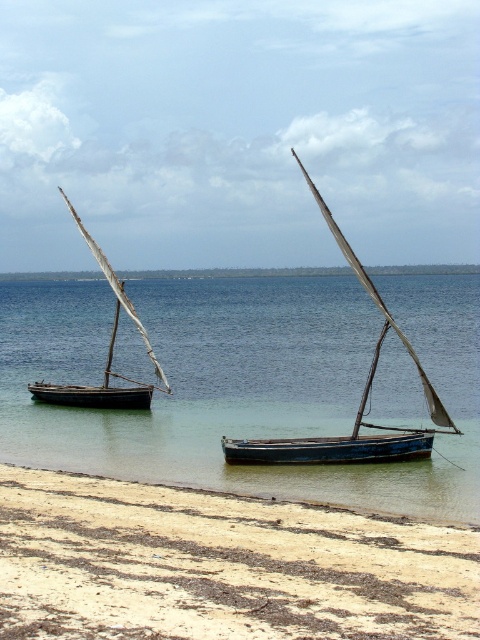
Question: Among these points, which one is farthest from the camera?

Choices:
 (A) pos(243,449)
 (B) pos(24,548)

Answer: (A)

Question: Does clear blue water at center have a smaller size compared to wooden sailboat at left?

Choices:
 (A) yes
 (B) no

Answer: (A)

Question: Observing the image, what is the correct spatial positioning of clear blue water at center in reference to brown sandy beach at lower left?

Choices:
 (A) right
 (B) left

Answer: (A)

Question: Which of the following is the farthest from the observer?

Choices:
 (A) brown sandy beach at lower left
 (B) blue wooden canoe at center

Answer: (B)

Question: Which of the following is the closest to the observer?

Choices:
 (A) (64, 198)
 (B) (57, 593)

Answer: (B)

Question: Considering the relative positions of clear blue water at center and wooden sail at center in the image provided, where is clear blue water at center located with respect to wooden sail at center?

Choices:
 (A) right
 (B) left

Answer: (A)